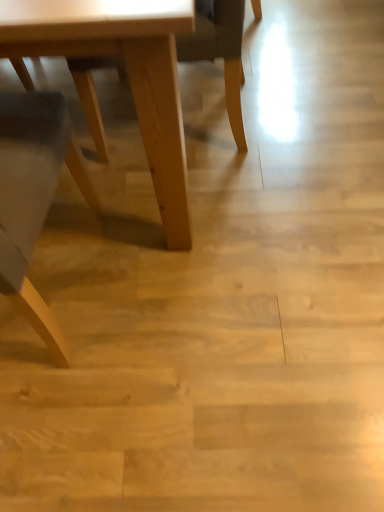
The width and height of the screenshot is (384, 512). In order to click on vacant space underneath light brown wood chair at center (from a real-world perspective) in this screenshot , I will do `click(205, 113)`.